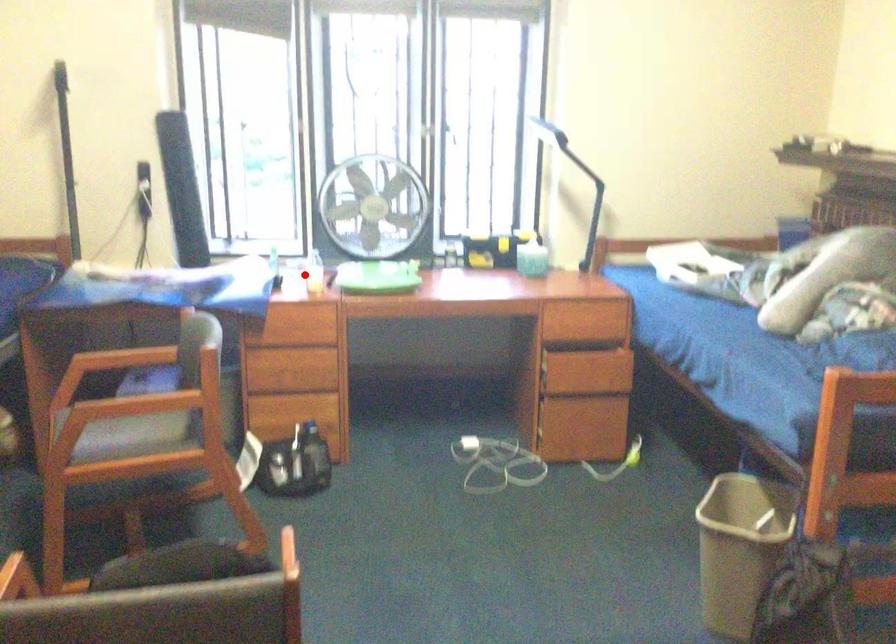
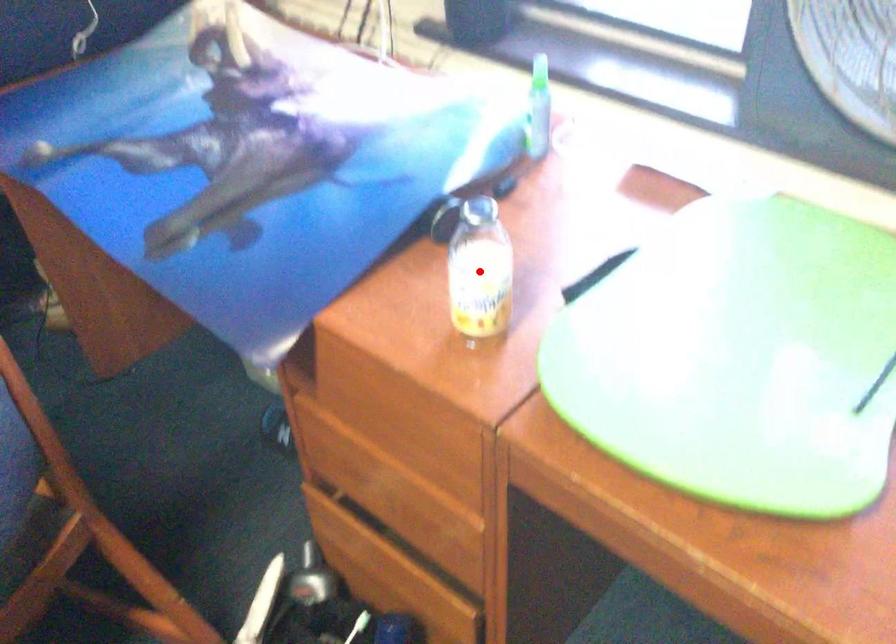
I am providing you with two images of the same scene from different viewpoints. A red point is marked on the first image and another point is marked on the second image. Do the highlighted points in image1 and image2 indicate the same real-world spot?

Yes